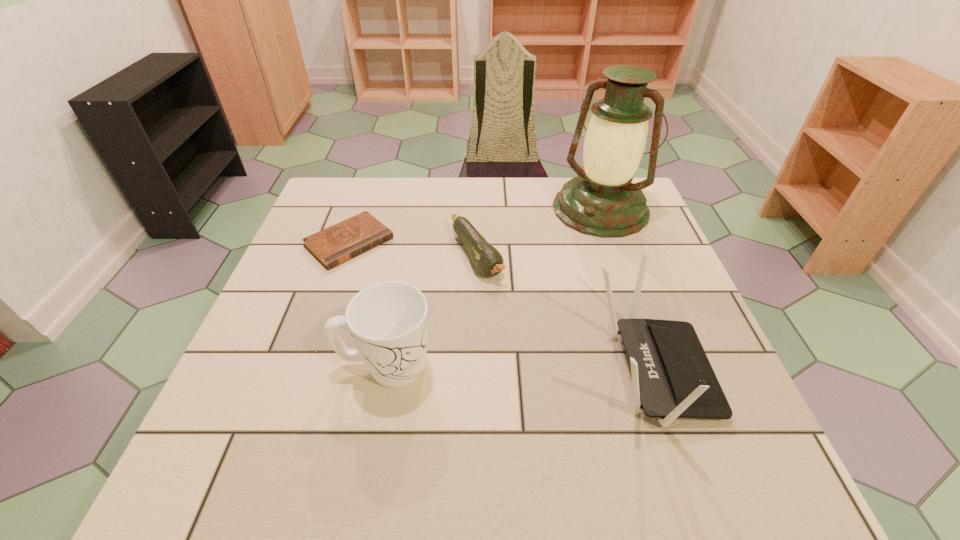
Select which object appears as the third closest to the lantern. Please provide its 2D coordinates. Your answer should be formatted as a tuple, i.e. [(x, y)], where the tuple contains the x and y coordinates of a point satisfying the conditions above.

[(332, 246)]

Find the location of a particular element. Image resolution: width=960 pixels, height=540 pixels. object that is the nearest to the router is located at coordinates (488, 261).